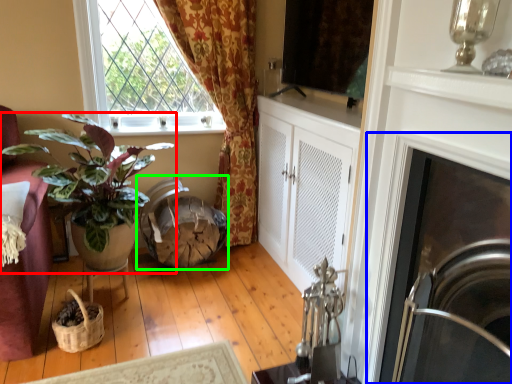
Question: Considering the real-world distances, which object is closest to houseplant (highlighted by a red box)? fireplace (highlighted by a blue box) or swivel chair (highlighted by a green box).

Choices:
 (A) fireplace
 (B) swivel chair

Answer: (B)